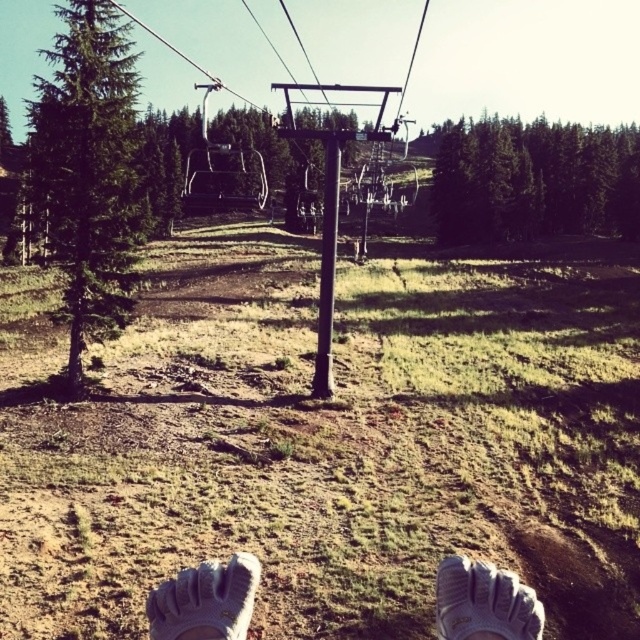
Question: Does white textured shoe at lower center appear under white mesh shoe at lower center?

Choices:
 (A) yes
 (B) no

Answer: (A)

Question: Which point is closer to the camera?

Choices:
 (A) white textured shoe at lower center
 (B) white textured shoes at lower center

Answer: (A)

Question: Does green textured pine tree at left have a larger size compared to white mesh shoe at lower center?

Choices:
 (A) no
 (B) yes

Answer: (B)

Question: Which object is the farthest from the white textured shoes at lower center?

Choices:
 (A) green matte tree at upper center
 (B) white mesh shoe at lower center
 (C) green textured pine tree at left

Answer: (A)

Question: Which point appears closest to the camera in this image?

Choices:
 (A) (202, 632)
 (B) (492, 621)
 (C) (118, 148)
 (D) (614, 216)

Answer: (A)

Question: Can you confirm if white textured shoes at lower center is positioned above white mesh shoe at lower center?

Choices:
 (A) no
 (B) yes

Answer: (A)